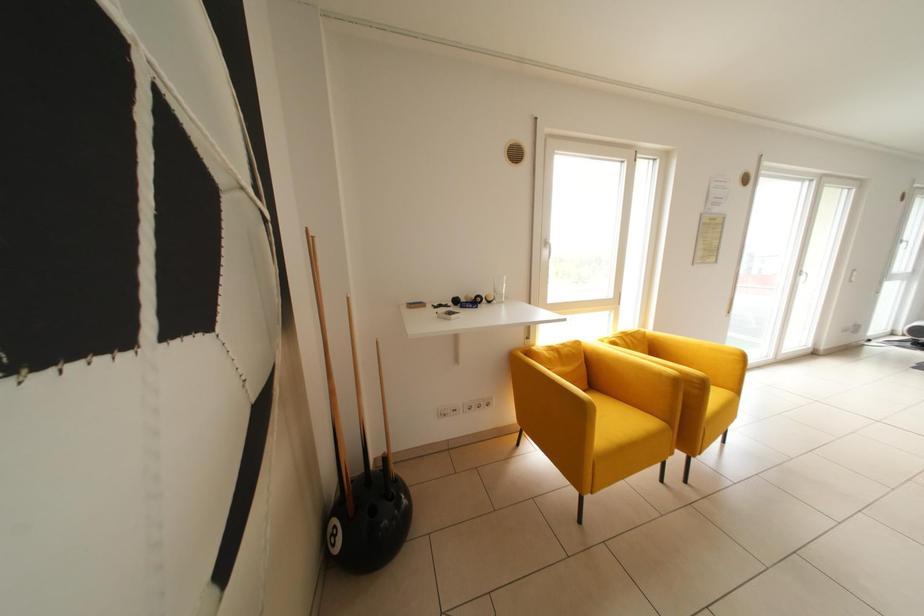
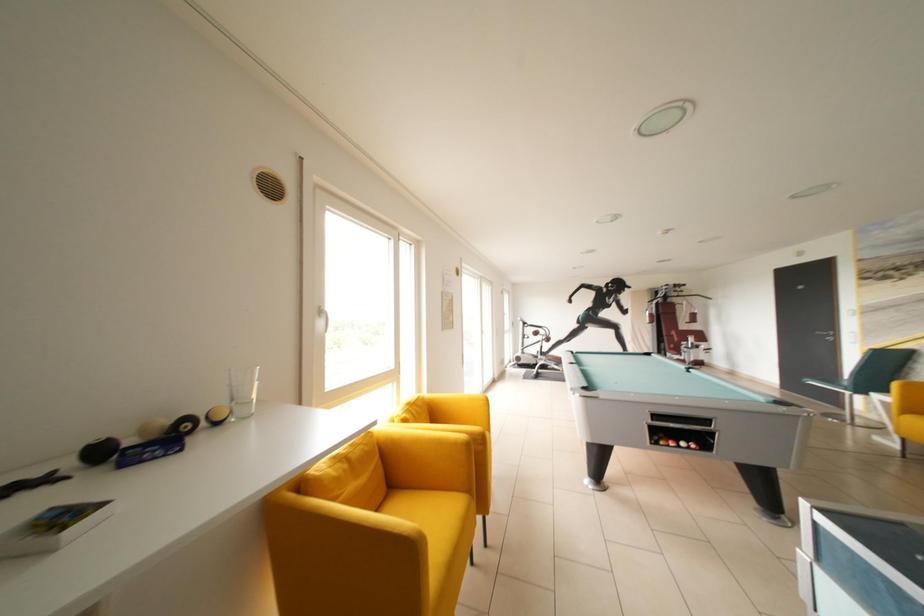
Question: How did the camera likely rotate?

Choices:
 (A) Left
 (B) Right
 (C) Up
 (D) Down

Answer: (B)